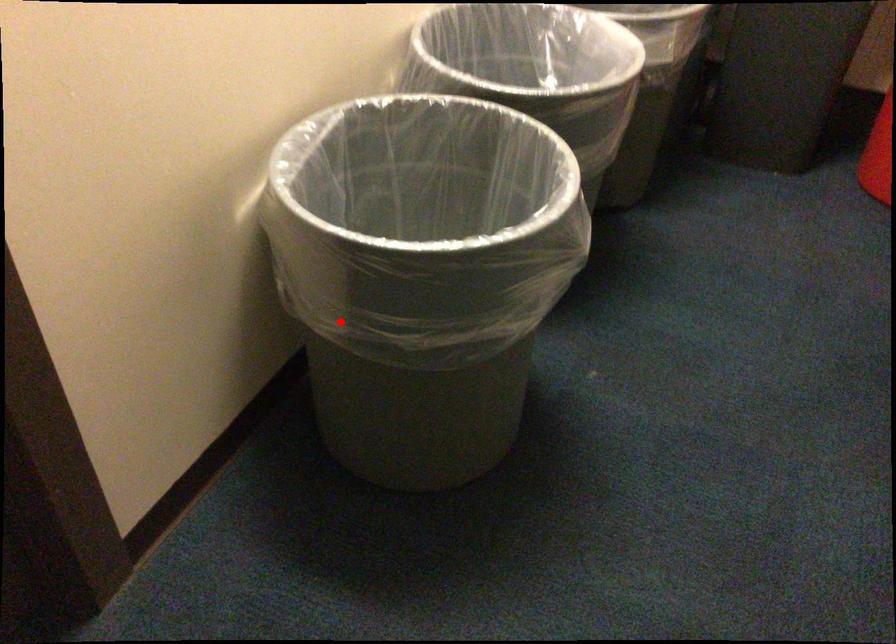
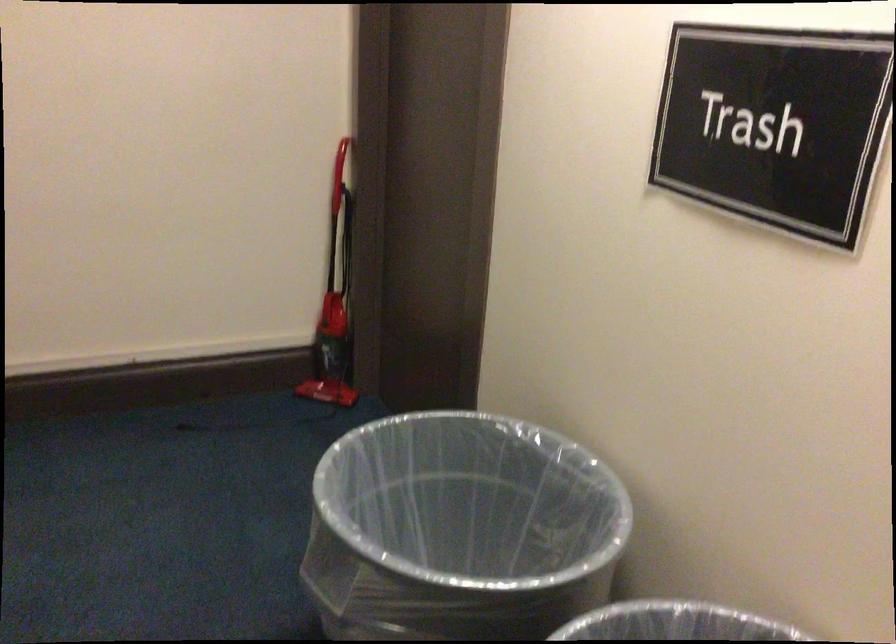
Locate, in the second image, the point that corresponds to the highlighted location in the first image.

(460, 529)